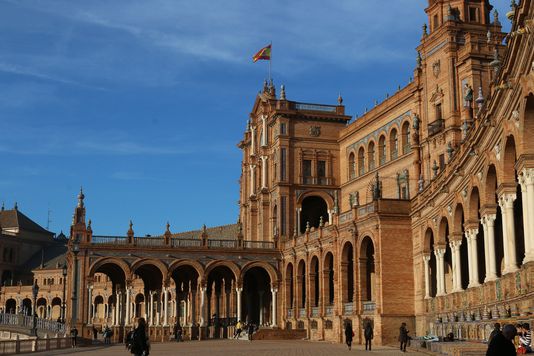
Find the location of `lamps`. lamps is located at coordinates (74, 239), (35, 289), (64, 272).